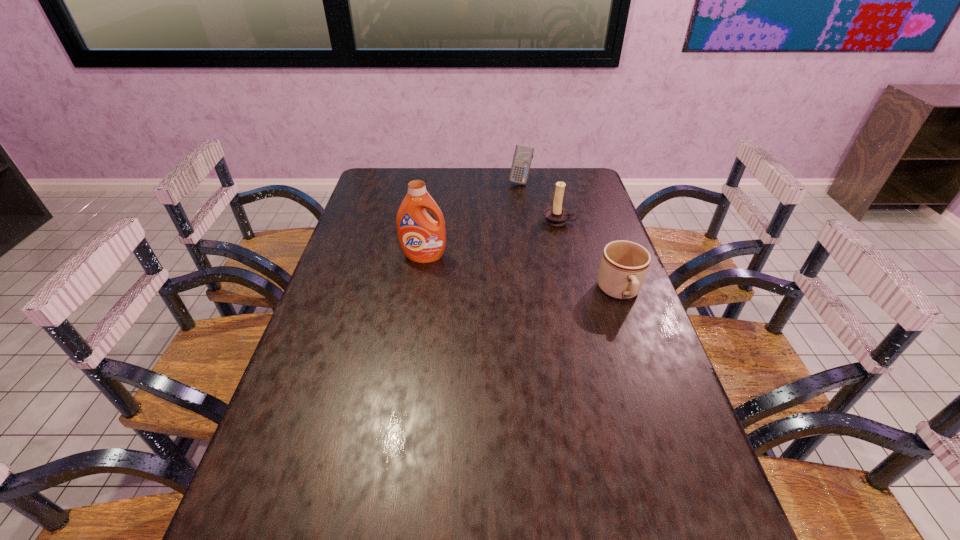
The height and width of the screenshot is (540, 960). Identify the location of free spot on the desktop that is between the detergent and the rightmost object and is positioned on the wick of the candle holder. (539, 278).

Find the location of a particular element. free spot on the desktop that is between the tallest object and the rightmost object and is positioned on the front-facing side of the calculator is located at coordinates [499, 271].